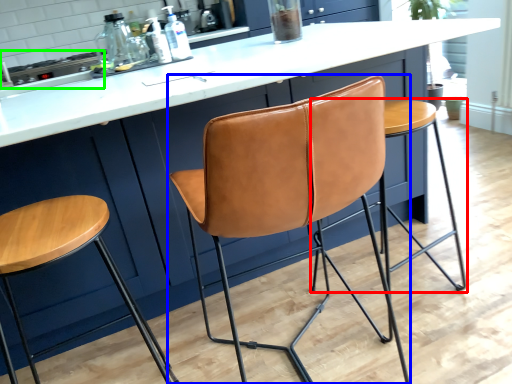
Question: Which is farther away from stool (highlighted by a red box)? chair (highlighted by a blue box) or appliance (highlighted by a green box)?

Choices:
 (A) chair
 (B) appliance

Answer: (B)